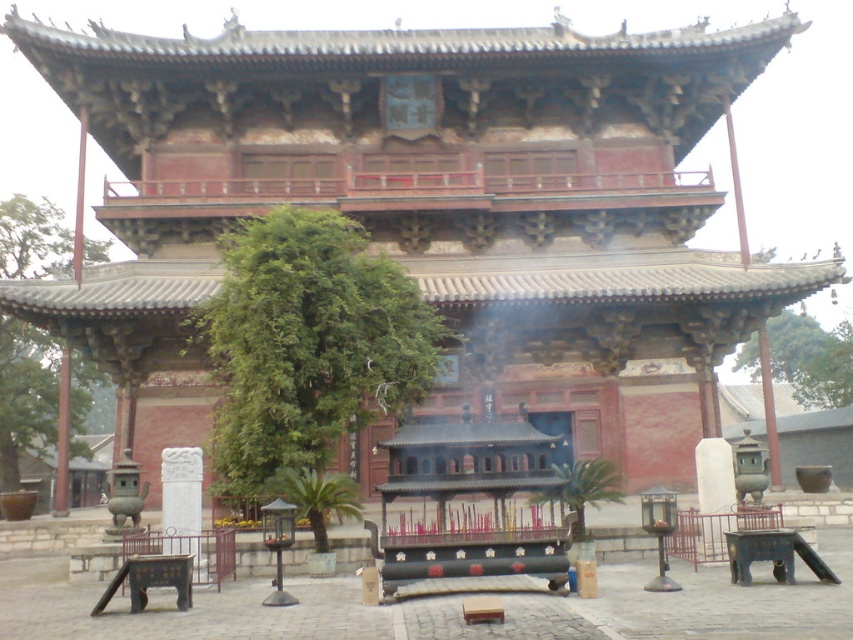
Question: Is green leafy tree at center above green leafy tree at left?

Choices:
 (A) no
 (B) yes

Answer: (A)

Question: In this image, where is green leafy tree at center located relative to green leafy tree at upper right?

Choices:
 (A) above
 (B) below

Answer: (A)

Question: Which of the following is the closest to the observer?

Choices:
 (A) green leafy tree at left
 (B) green leafy tree at center
 (C) green leafy tree at upper right

Answer: (B)

Question: Which point is farther from the camera taking this photo?

Choices:
 (A) 263,307
 (B) 68,266

Answer: (B)

Question: Which object is the closest to the green leafy tree at center?

Choices:
 (A) green leafy tree at upper right
 (B) green leafy tree at left

Answer: (B)

Question: Does green leafy tree at center have a lesser width compared to green leafy tree at left?

Choices:
 (A) yes
 (B) no

Answer: (A)